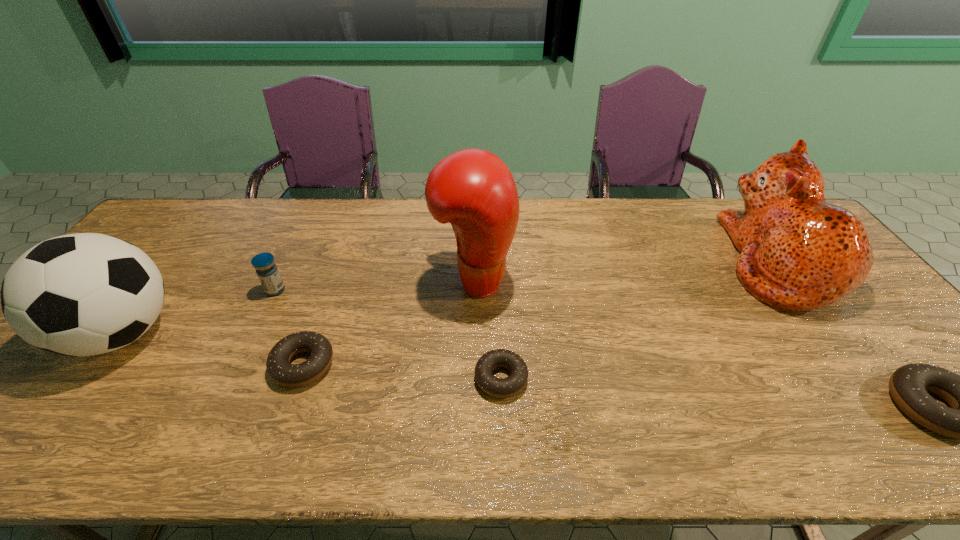
The image size is (960, 540). What are the coordinates of `vacant space located 0.230m on the right of the second doughnut from left to right` in the screenshot? It's located at (625, 378).

At what (x,y) coordinates should I click in order to perform the action: click on vacant region located 0.250m on the striking surface of the boxing glove. Please return your answer as a coordinate pair (x, y). Looking at the image, I should click on pyautogui.click(x=599, y=280).

In order to click on free space located on the face of the cat in this screenshot , I will do `click(669, 262)`.

Find the location of a particular element. The height and width of the screenshot is (540, 960). vacant region located on the face of the cat is located at coordinates (665, 262).

Where is `blank space located on the face of the cat`? blank space located on the face of the cat is located at coordinates (672, 262).

This screenshot has width=960, height=540. I want to click on vacant space located on the right of the fourth shortest object, so click(348, 290).

This screenshot has width=960, height=540. Identify the location of vacant area situated on the right of the soccer ball. (318, 334).

The width and height of the screenshot is (960, 540). I want to click on object at the far edge, so click(798, 253).

Identify the location of soccer ball located in the near edge section of the desktop. The height and width of the screenshot is (540, 960). (83, 294).

Identify the location of object located in the left edge section of the desktop. (83, 294).